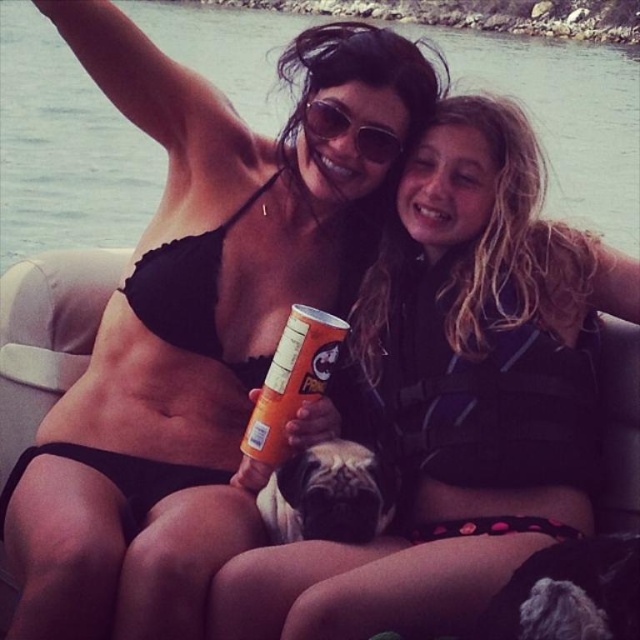
From the picture: You are a photographer trying to capture the perfect shot of the black bikini at center. Based on its coordinates, where should you position your camera to ensure it is centered in the frame?

The black bikini at center is located at point coordinates, so positioning the camera directly at those coordinates would center it in the frame.

You are a photographer trying to capture a candid shot of the sunglasses at center without the fluffy gray dog at lower right blocking the view. Is there a way to adjust your position to achieve this?

The fluffy gray dog at lower right is in front of the sunglasses at center, so moving to a position where the dog is no longer between you and the sunglasses would allow you to capture the sunglasses without obstruction.

You are a photographer trying to capture the best angle of the black matte bikini top at upper center and the orange matte can at center. Since you want to ensure both are visible in the frame, which object should you focus on first to maintain their positions?

The black matte bikini top at upper center is above the orange matte can at center, so focusing on the black matte bikini top at upper center first will help ensure both are in frame as it is positioned higher.